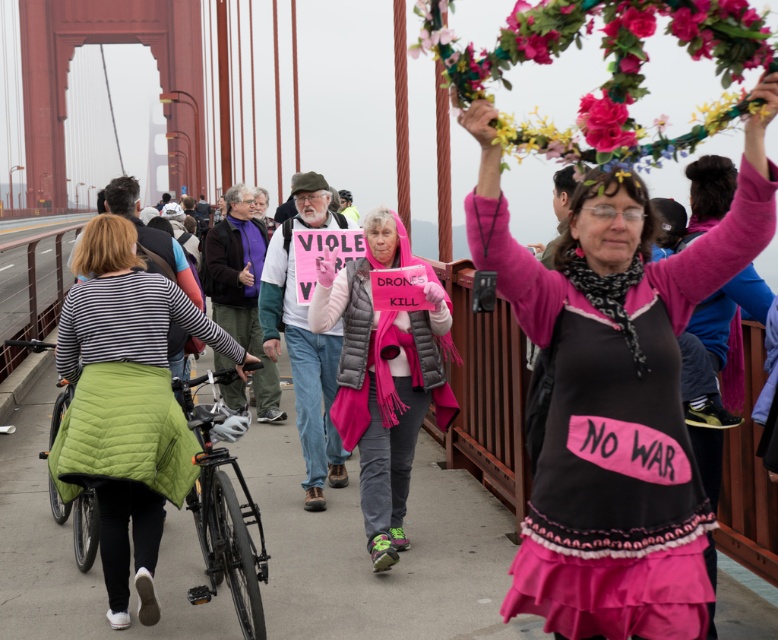
You are a photographer standing at the base of the Golden Gate Bridge, aiming to capture a photo of the protest. You want to ensure both the pink fabric shirt at center and the floral garland at upper center are visible in your shot. Based on their positions, which object should you focus on first to frame both elements effectively?

The pink fabric shirt at center is to the left of the floral garland at upper center. To frame both effectively, focus on the pink fabric shirt at center first, as it is positioned to the left, allowing you to adjust the camera angle to include the floral garland at upper center in the upper part of the frame.